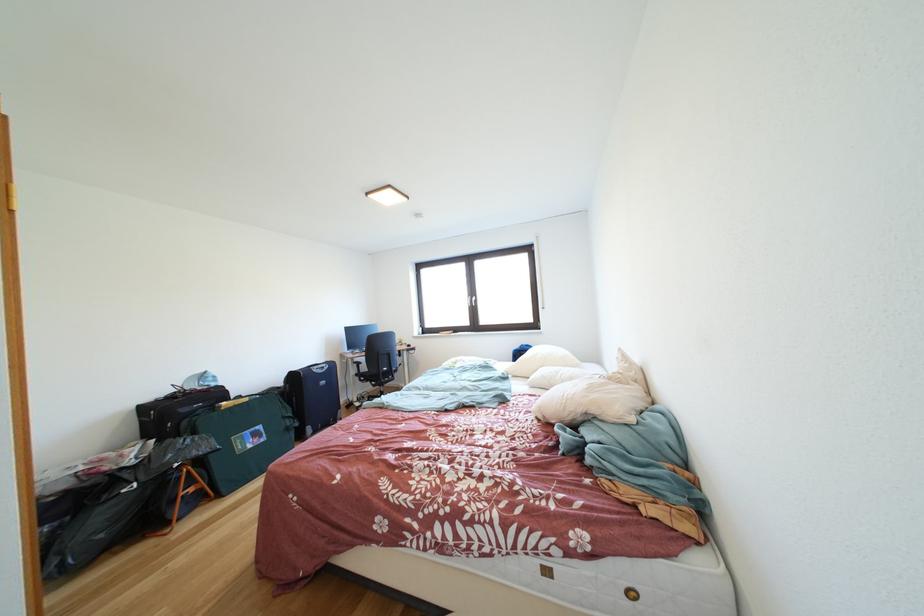
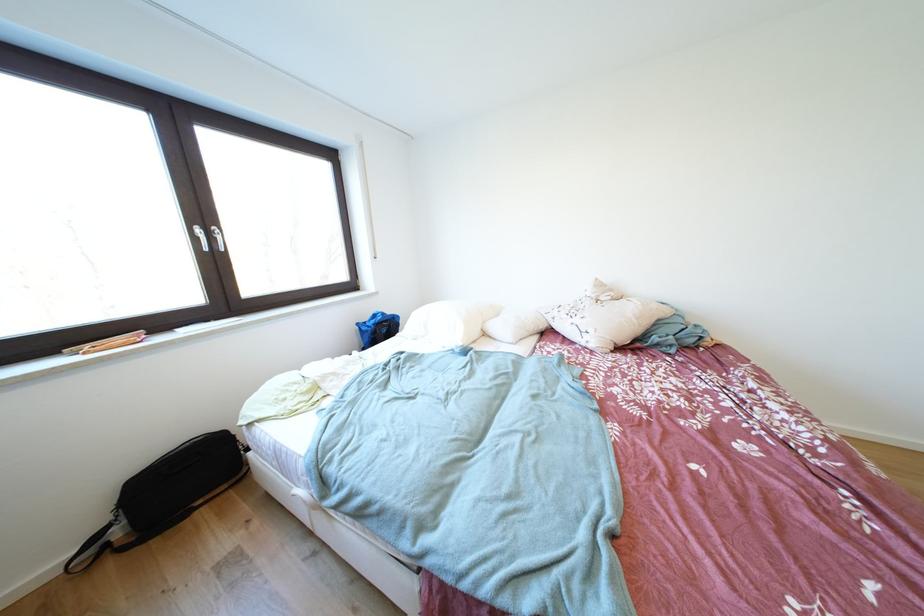
Where in the second image is the point corresponding to point 570,371 from the first image?

(505, 320)